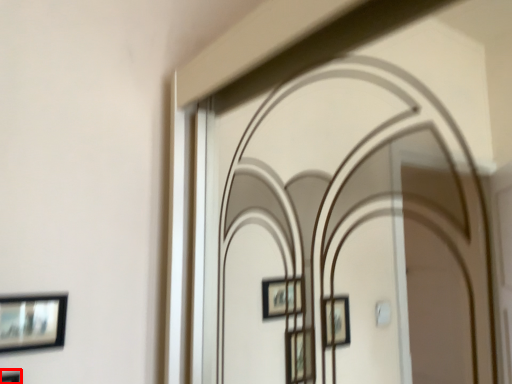
Question: Observing the image, what is the correct spatial positioning of picture frame (annotated by the red box) in reference to picture frame?

Choices:
 (A) left
 (B) right

Answer: (A)